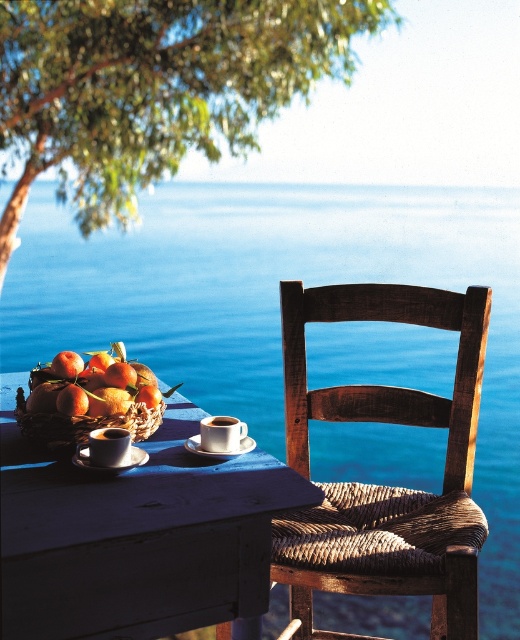
Question: Which point is farther to the camera?

Choices:
 (A) (x=124, y=467)
 (B) (x=239, y=444)

Answer: (B)

Question: Estimate the real-world distances between objects in this image. Which object is closer to the matte ceramic cup at center?

Choices:
 (A) orange matte fruit at center
 (B) white ceramic saucer at center
 (C) blue water at table right

Answer: (B)

Question: Which point is farther from the camera taking this photo?

Choices:
 (A) (266, 595)
 (B) (67, 372)

Answer: (B)

Question: Is shiny golden apples at left closer to camera compared to white ceramic saucer at lower left?

Choices:
 (A) yes
 (B) no

Answer: (B)

Question: Is green leafy tree at upper left wider than rattan wood chair at center?

Choices:
 (A) yes
 (B) no

Answer: (A)

Question: Observing the image, what is the correct spatial positioning of orange matte fruit at center in reference to white ceramic saucer at center?

Choices:
 (A) left
 (B) right

Answer: (A)